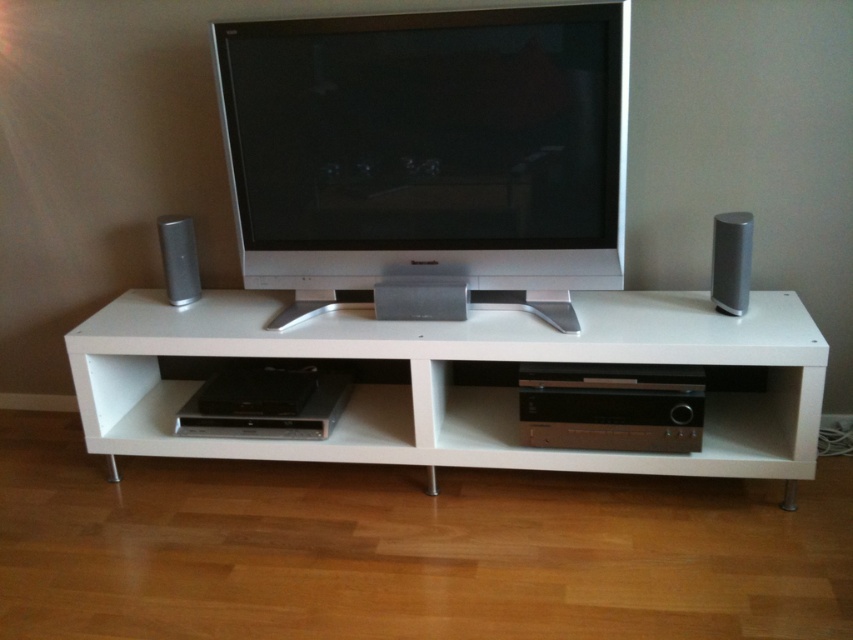
You are setting up a new sound system and need to place a large amplifier. The amplifier is the size of the black metallic receiver at lower center. Can the white matte entertainment center at center accommodate the amplifier?

The white matte entertainment center at center is bigger than the black metallic receiver at lower center, so yes, the amplifier can fit inside the white matte entertainment center at center since it has enough space.

You are setting up a new TV and want to place the satin silver flat screen tv at center and the white matte entertainment center at center in the room. According to the image, which object is on the left side?

The satin silver flat screen tv at center is positioned on the left side of white matte entertainment center at center.